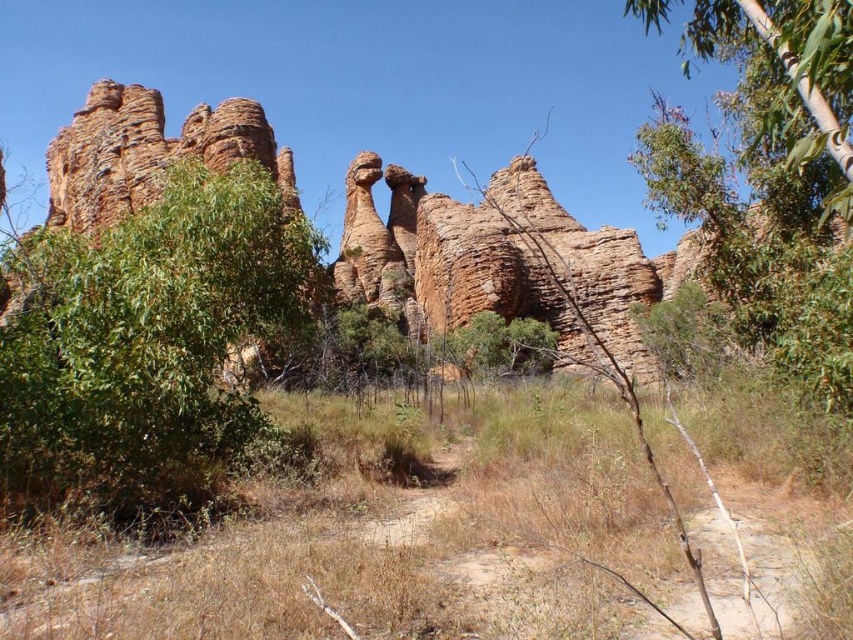
Question: Observing the image, what is the correct spatial positioning of green leafy bush at left in reference to green leafy tree at upper right?

Choices:
 (A) left
 (B) right

Answer: (A)

Question: Which of these objects is positioned farthest from the dry grass at lower center?

Choices:
 (A) green leafy tree at upper right
 (B) green leafy bush at left

Answer: (A)

Question: Does green leafy bush at left have a greater width compared to green leafy tree at upper right?

Choices:
 (A) yes
 (B) no

Answer: (B)

Question: Which object is positioned closest to the dry grass at lower center?

Choices:
 (A) green leafy tree at upper right
 (B) green leafy bush at left

Answer: (B)

Question: Does green leafy bush at left appear on the left side of green leafy tree at upper right?

Choices:
 (A) no
 (B) yes

Answer: (B)

Question: Considering the real-world distances, which object is closest to the green leafy bush at left?

Choices:
 (A) green leafy tree at upper right
 (B) dry grass at lower center

Answer: (B)